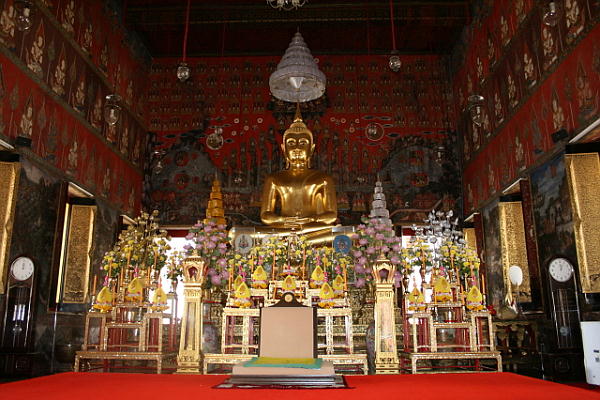
At what (x,y) coordinates should I click in order to perform the action: click on tall decor. Please return your answer as a coordinate pair (x, y). Looking at the image, I should click on (191, 276), (383, 281), (209, 209), (386, 208).